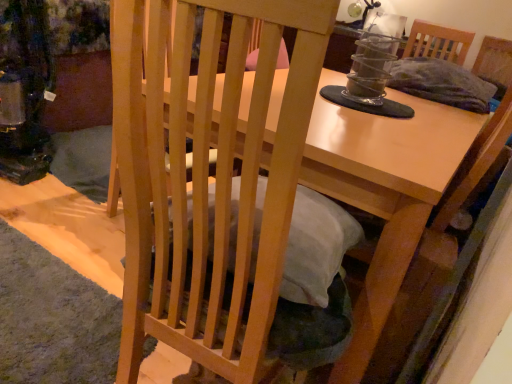
Question: From the image's perspective, is natural wood chair at center located above light brown wooden table at center?

Choices:
 (A) yes
 (B) no

Answer: (B)

Question: Does natural wood chair at center appear on the left side of light brown wooden table at center?

Choices:
 (A) no
 (B) yes

Answer: (B)

Question: Does natural wood chair at center appear on the right side of light brown wooden table at center?

Choices:
 (A) no
 (B) yes

Answer: (A)

Question: Is light brown wooden table at center located within natural wood chair at center?

Choices:
 (A) yes
 (B) no

Answer: (B)

Question: Does natural wood chair at center have a lesser width compared to light brown wooden table at center?

Choices:
 (A) yes
 (B) no

Answer: (A)

Question: Considering the relative sizes of natural wood chair at center and light brown wooden table at center in the image provided, is natural wood chair at center shorter than light brown wooden table at center?

Choices:
 (A) yes
 (B) no

Answer: (B)

Question: From the image's perspective, would you say light brown wooden table at center is positioned over natural wood chair at center?

Choices:
 (A) no
 (B) yes

Answer: (B)

Question: Is light brown wooden table at center behind natural wood chair at center?

Choices:
 (A) yes
 (B) no

Answer: (A)

Question: Can you confirm if light brown wooden table at center is positioned to the left of natural wood chair at center?

Choices:
 (A) yes
 (B) no

Answer: (B)

Question: Is light brown wooden table at center next to natural wood chair at center and touching it?

Choices:
 (A) no
 (B) yes

Answer: (A)

Question: Is light brown wooden table at center turned away from natural wood chair at center?

Choices:
 (A) no
 (B) yes

Answer: (A)

Question: Is light brown wooden table at center bigger than natural wood chair at center?

Choices:
 (A) no
 (B) yes

Answer: (B)

Question: From the image's perspective, is light brown wooden table at center located above or below natural wood chair at center?

Choices:
 (A) below
 (B) above

Answer: (B)